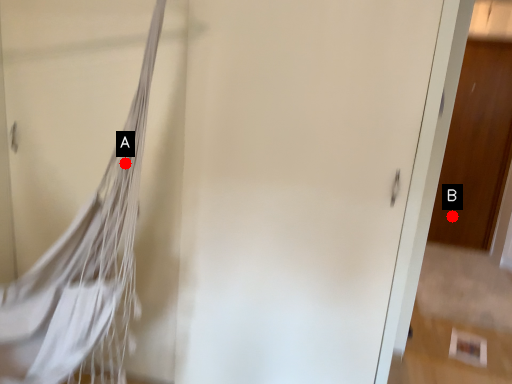
Question: Two points are circled on the image, labeled by A and B beside each circle. Which point is closer to the camera?

Choices:
 (A) A is closer
 (B) B is closer

Answer: (A)